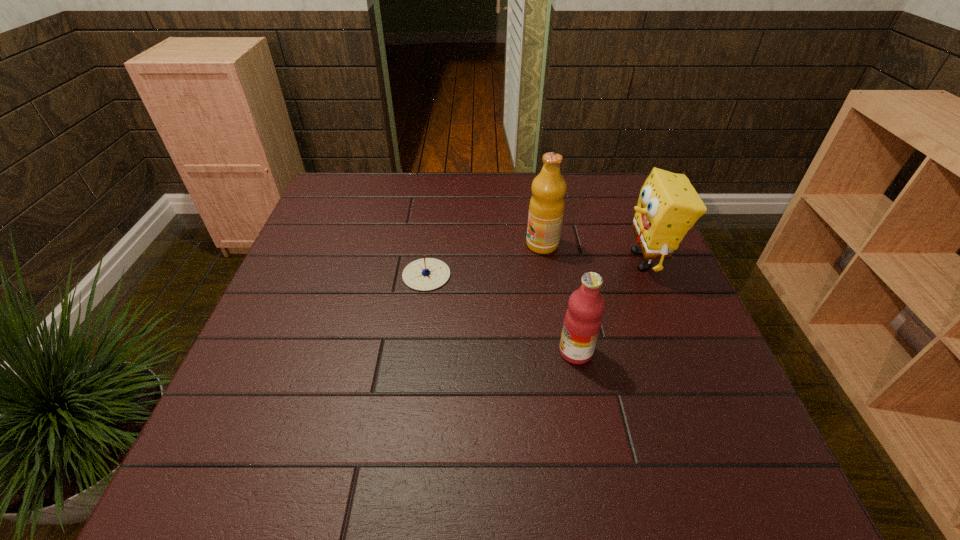
The image size is (960, 540). Identify the location of blank space located 0.270m on the face of the rightmost object. (516, 260).

At what (x,y) coordinates should I click in order to perform the action: click on vacant space positioned 0.300m on the face of the rightmost object. Please return your answer as a coordinate pair (x, y). The height and width of the screenshot is (540, 960). Looking at the image, I should click on (504, 260).

Locate an element on the screen. Image resolution: width=960 pixels, height=540 pixels. vacant space located 0.190m on the label of the nearer fruit juice is located at coordinates (468, 352).

The image size is (960, 540). Identify the location of free space located 0.400m on the label of the nearer fruit juice. (369, 352).

Image resolution: width=960 pixels, height=540 pixels. I want to click on vacant space located on the label of the nearer fruit juice, so [x=520, y=352].

In order to click on blank area located 0.210m on the front of the shortest object in this screenshot , I will do `click(415, 364)`.

Locate an element on the screen. object located in the right edge section of the desktop is located at coordinates (668, 206).

Identify the location of blank space at the far edge of the desktop. The image size is (960, 540). (424, 211).

In the image, there is a desktop. At what (x,y) coordinates should I click in order to perform the action: click on blank space at the near edge. Please return your answer as a coordinate pair (x, y). The image size is (960, 540). Looking at the image, I should click on (484, 477).

Locate an element on the screen. vacant space at the left edge of the desktop is located at coordinates (347, 273).